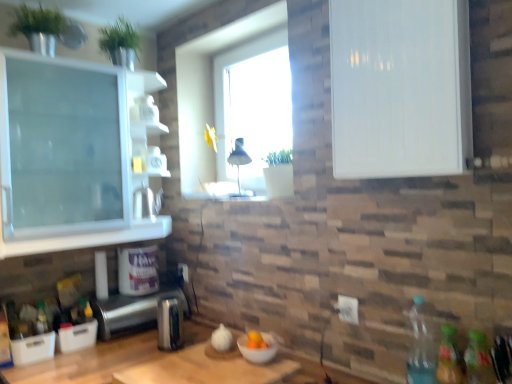
Question: Is translucent glass jar at upper center outside clear plastic bottle at lower right, the 2th bottle from the back?

Choices:
 (A) no
 (B) yes

Answer: (B)

Question: From the image's perspective, is translucent glass jar at upper center above clear plastic bottle at lower right, which appears as the third bottle when viewed from the right?

Choices:
 (A) yes
 (B) no

Answer: (A)

Question: Does translucent glass jar at upper center have a larger size compared to clear plastic bottle at lower right, which ranks as the third bottle in front-to-back order?

Choices:
 (A) no
 (B) yes

Answer: (A)

Question: From a real-world perspective, is translucent glass jar at upper center positioned under clear plastic bottle at lower right, which appears as the third bottle when viewed from the right, based on gravity?

Choices:
 (A) no
 (B) yes

Answer: (A)

Question: Can you confirm if translucent glass jar at upper center is shorter than clear plastic bottle at lower right, which ranks as the third bottle in front-to-back order?

Choices:
 (A) no
 (B) yes

Answer: (B)

Question: Considering their positions, is translucent glass jar at upper center located in front of or behind satin silver toaster at lower left, arranged as the 2th appliance when viewed from the front?

Choices:
 (A) behind
 (B) front

Answer: (A)

Question: Is translucent glass jar at upper center bigger or smaller than satin silver toaster at lower left, arranged as the 2th appliance when viewed from the front?

Choices:
 (A) small
 (B) big

Answer: (A)

Question: Is translucent glass jar at upper center to the left or to the right of satin silver toaster at lower left, arranged as the 2th appliance when viewed from the front, in the image?

Choices:
 (A) right
 (B) left

Answer: (A)

Question: Is point (163, 170) positioned closer to the camera than point (115, 321)?

Choices:
 (A) closer
 (B) farther

Answer: (B)

Question: From the image's perspective, relative to satin silver toaster at lower center, which is the 1th appliance in front-to-back order, is translucent plastic bottle at lower right, which is the 2th bottle from front to back, above or below?

Choices:
 (A) above
 (B) below

Answer: (A)

Question: Considering the positions of translucent plastic bottle at lower right, which is counted as the third bottle, starting from the back, and satin silver toaster at lower center, which is the 1th appliance in front-to-back order, in the image, is translucent plastic bottle at lower right, which is counted as the third bottle, starting from the back, wider or thinner than satin silver toaster at lower center, which is the 1th appliance in front-to-back order,?

Choices:
 (A) wide
 (B) thin

Answer: (B)

Question: From a real-world perspective, relative to satin silver toaster at lower center, which is the 3th appliance in back-to-front order, is translucent plastic bottle at lower right, which is the 3th bottle in left-to-right order, vertically above or below?

Choices:
 (A) below
 (B) above

Answer: (B)

Question: In terms of height, does translucent plastic bottle at lower right, which is the 2th bottle from front to back, look taller or shorter compared to satin silver toaster at lower center, which is the 1th appliance in front-to-back order?

Choices:
 (A) tall
 (B) short

Answer: (A)

Question: In terms of size, does satin silver toaster at lower left, which is the 2th appliance from back to front, appear bigger or smaller than transparent glass window at center?

Choices:
 (A) small
 (B) big

Answer: (A)

Question: Based on their positions, is satin silver toaster at lower left, which is the 2th appliance from back to front, located to the left or right of transparent glass window at center?

Choices:
 (A) right
 (B) left

Answer: (B)